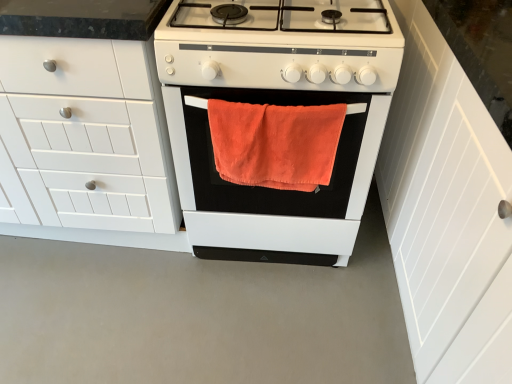
Where is `free space in front of white matte cabinet at left, arranged as the first cabinetry when viewed from the left`? This screenshot has height=384, width=512. free space in front of white matte cabinet at left, arranged as the first cabinetry when viewed from the left is located at coordinates (90, 311).